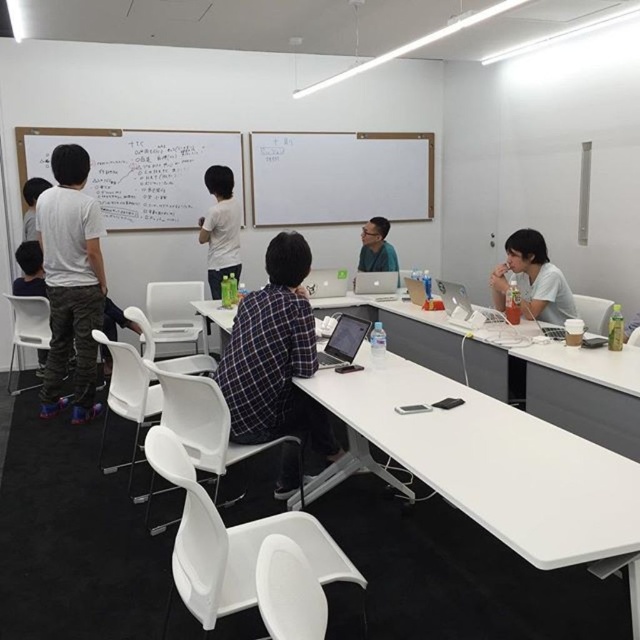
Question: Which object is closer to the camera taking this photo?

Choices:
 (A) matte white shirt at right
 (B) white matte whiteboard at upper left

Answer: (A)

Question: Which object is positioned closest to the white matte whiteboard at upper left?

Choices:
 (A) white cotton shirt at left
 (B) satin black laptop at center
 (C) plaid fabric shirt at center
 (D) matte black shirt at center

Answer: (A)

Question: Based on their relative distances, which object is farther from the satin black laptop at center?

Choices:
 (A) plaid fabric shirt at center
 (B) matte white shirt at right

Answer: (B)

Question: Can you confirm if white matte whiteboard at upper center is thinner than satin black laptop at center?

Choices:
 (A) yes
 (B) no

Answer: (B)

Question: Is matte white shirt at right behind satin black laptop at center?

Choices:
 (A) yes
 (B) no

Answer: (A)

Question: Is plaid fabric shirt at center in front of matte white shirt at upper left?

Choices:
 (A) no
 (B) yes

Answer: (B)